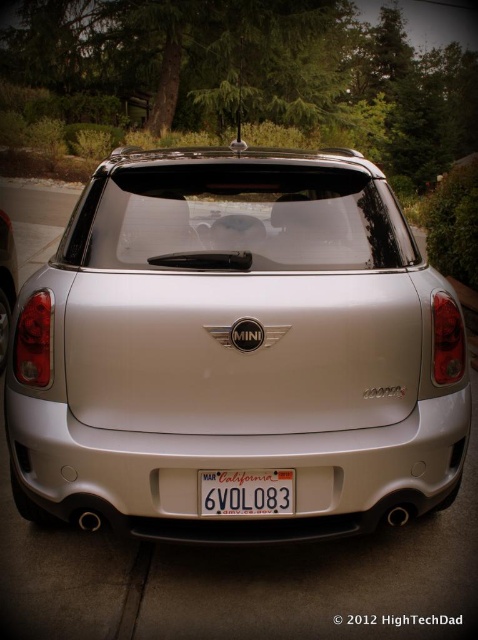
Question: Which of the following is the farthest from the observer?

Choices:
 (A) satin silver car at center
 (B) white plastic license plate at center

Answer: (B)

Question: Which object is farther from the camera taking this photo?

Choices:
 (A) satin silver car at center
 (B) white plastic license plate at center

Answer: (B)

Question: Is satin silver car at center to the left of white plastic license plate at center from the viewer's perspective?

Choices:
 (A) no
 (B) yes

Answer: (B)

Question: Does satin silver car at center have a smaller size compared to white plastic license plate at center?

Choices:
 (A) no
 (B) yes

Answer: (A)

Question: Does satin silver car at center come in front of white plastic license plate at center?

Choices:
 (A) no
 (B) yes

Answer: (B)